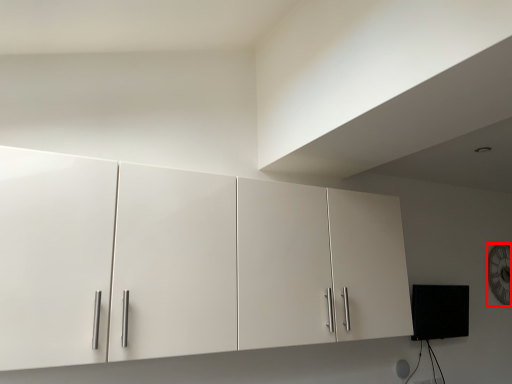
Question: Considering the relative positions of clock (annotated by the red box) and cupboard in the image provided, where is clock (annotated by the red box) located with respect to the staircase?

Choices:
 (A) left
 (B) right

Answer: (B)